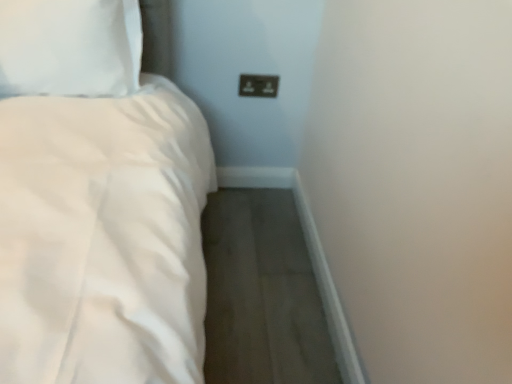
This screenshot has height=384, width=512. I want to click on brown plastic socket at upper center, so click(x=258, y=85).

What is the approximate height of brown plastic socket at upper center?

brown plastic socket at upper center is 3.59 inches in height.

The height and width of the screenshot is (384, 512). What do you see at coordinates (258, 85) in the screenshot?
I see `brown plastic socket at upper center` at bounding box center [258, 85].

Measure the distance between point (67, 4) and camera.

They are 1.10 meters apart.

This screenshot has width=512, height=384. Describe the element at coordinates (70, 47) in the screenshot. I see `white soft pillow at upper left` at that location.

Measure the distance between white soft pillow at upper left and camera.

The depth of white soft pillow at upper left is 3.54 feet.

You are a GUI agent. You are given a task and a screenshot of the screen. Output one action in this format:
    pyautogui.click(x=<x>, y=<y>)
    Task: Click on the white soft pillow at upper left
    
    Given the screenshot: What is the action you would take?
    pyautogui.click(x=70, y=47)

In order to face white soft pillow at upper left, should I rotate leftwards or rightwards?

A 22.962 degree turn to the left will do.

Identify the location of brown plastic socket at upper center. (258, 85).

Between white soft pillow at upper left and brown plastic socket at upper center, which one appears on the right side from the viewer's perspective?

brown plastic socket at upper center.

In the scene shown: Which is behind, white soft pillow at upper left or brown plastic socket at upper center?

brown plastic socket at upper center is more distant.

Considering the positions of points (97, 66) and (251, 82), is point (97, 66) closer to camera compared to point (251, 82)?

Yes, point (97, 66) is closer to viewer.

From the image's perspective, is white soft pillow at upper left on top of brown plastic socket at upper center?

Indeed, from the image's perspective, white soft pillow at upper left is shown above brown plastic socket at upper center.

From a real-world perspective, is white soft pillow at upper left below brown plastic socket at upper center?

Incorrect, from a real-world perspective, white soft pillow at upper left is higher than brown plastic socket at upper center.

Which of these two, white soft pillow at upper left or brown plastic socket at upper center, is wider?

Wider between the two is white soft pillow at upper left.

In terms of height, does white soft pillow at upper left look taller or shorter compared to brown plastic socket at upper center?

white soft pillow at upper left is taller than brown plastic socket at upper center.

Considering the relative sizes of white soft pillow at upper left and brown plastic socket at upper center in the image provided, is white soft pillow at upper left smaller than brown plastic socket at upper center?

Actually, white soft pillow at upper left might be larger than brown plastic socket at upper center.

Is white soft pillow at upper left not inside brown plastic socket at upper center?

Yes.

In the scene shown: Are white soft pillow at upper left and brown plastic socket at upper center far apart?

white soft pillow at upper left is actually quite close to brown plastic socket at upper center.

Is brown plastic socket at upper center at the back of white soft pillow at upper left?

No.

Measure the distance between white soft pillow at upper left and brown plastic socket at upper center.

white soft pillow at upper left and brown plastic socket at upper center are 23.97 inches apart.

The width and height of the screenshot is (512, 384). In the image, there is a white soft pillow at upper left. In order to click on socket below it (from the image's perspective) in this screenshot , I will do `click(258, 85)`.

Considering the positions of objects brown plastic socket at upper center and white soft pillow at upper left in the image provided, who is more to the left, brown plastic socket at upper center or white soft pillow at upper left?

white soft pillow at upper left is more to the left.

Is the depth of brown plastic socket at upper center less than that of white soft pillow at upper left?

No, the depth of brown plastic socket at upper center is greater than that of white soft pillow at upper left.

Considering the positions of point (247, 74) and point (89, 25), is point (247, 74) closer or farther from the camera than point (89, 25)?

Clearly, point (247, 74) is more distant from the camera than point (89, 25).

From the image's perspective, is brown plastic socket at upper center located beneath white soft pillow at upper left?

Indeed, from the image's perspective, brown plastic socket at upper center is shown beneath white soft pillow at upper left.

From a real-world perspective, does brown plastic socket at upper center sit lower than white soft pillow at upper left?

Indeed, from a real-world perspective, brown plastic socket at upper center is positioned beneath white soft pillow at upper left.

Between brown plastic socket at upper center and white soft pillow at upper left, which one has smaller width?

brown plastic socket at upper center.

Who is shorter, brown plastic socket at upper center or white soft pillow at upper left?

Standing shorter between the two is brown plastic socket at upper center.

Who is bigger, brown plastic socket at upper center or white soft pillow at upper left?

white soft pillow at upper left is bigger.

Is white soft pillow at upper left inside brown plastic socket at upper center?

Definitely not — white soft pillow at upper left is not inside brown plastic socket at upper center.

Would you say brown plastic socket at upper center is a long distance from white soft pillow at upper left?

That's not correct — brown plastic socket at upper center is a little close to white soft pillow at upper left.

Could you tell me if brown plastic socket at upper center is facing white soft pillow at upper left?

No.

Locate an element on the screen. This screenshot has height=384, width=512. pillow that is on the left side of brown plastic socket at upper center is located at coordinates (70, 47).

Identify the location of socket that appears below the white soft pillow at upper left (from a real-world perspective). This screenshot has width=512, height=384. (258, 85).

Where is `socket below the white soft pillow at upper left (from the image's perspective)`? The height and width of the screenshot is (384, 512). socket below the white soft pillow at upper left (from the image's perspective) is located at coordinates (258, 85).